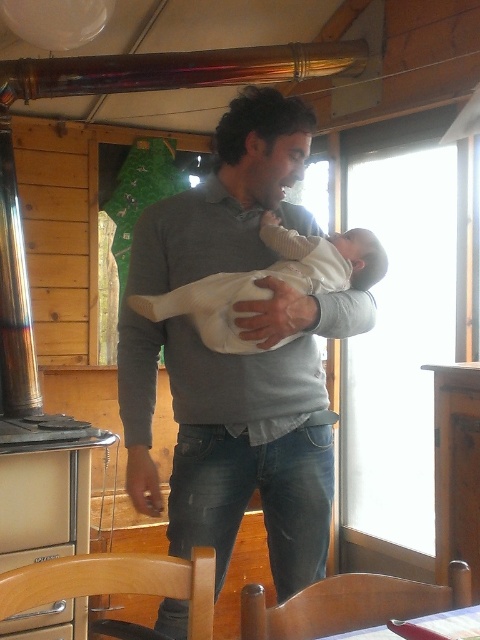
Is the position of gray cotton sweater at center more distant than that of white soft baby at center?

No, it is not.

Measure the distance between gray cotton sweater at center and camera.

gray cotton sweater at center is 1.48 meters away from camera.

This screenshot has width=480, height=640. I want to click on gray cotton sweater at center, so click(x=238, y=356).

From the picture: Is the position of gray cotton sweater at center less distant than that of metallic gray oven at lower left?

Yes, it is.

Does point (320, 380) lie in front of point (83, 445)?

Yes, it is.

Where is `gray cotton sweater at center`? The image size is (480, 640). gray cotton sweater at center is located at coordinates (238, 356).

The height and width of the screenshot is (640, 480). I want to click on gray cotton sweater at center, so click(238, 356).

Based on the photo, measure the distance between point (238,241) and camera.

Point (238,241) and camera are 5.37 feet apart from each other.

Locate an element on the screen. gray cotton sweater at center is located at coordinates (238, 356).